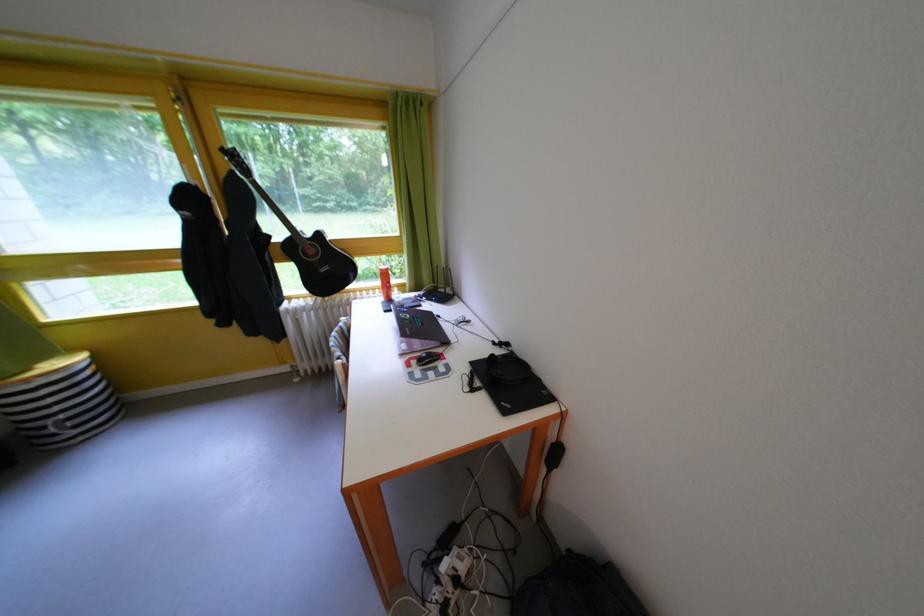
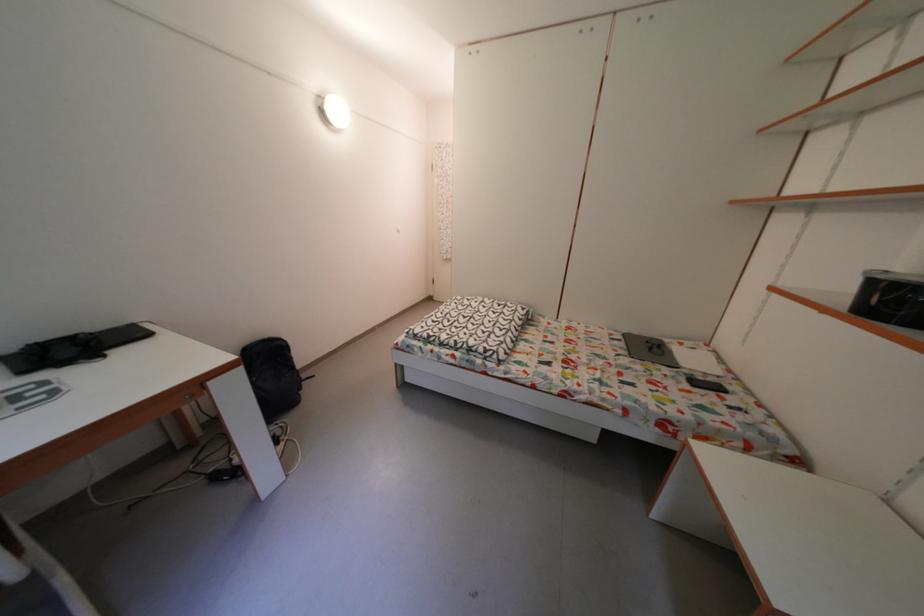
Where in the second image is the point corresponding to the point at 521,358 from the first image?

(6, 363)